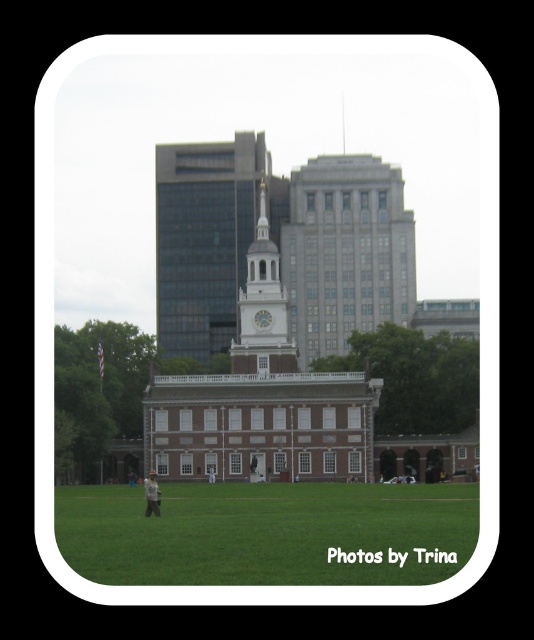
You are standing at point (256, 316) and want to walk to the front entrance of Independence Hall. Which direction should you move relative to point (213, 289)?

Since point (213, 289) is behind point (256, 316), you should move towards the direction away from point (213, 289) to reach the front entrance of Independence Hall.

You are planning to host a small picnic for 10 people in the park near the historical building. Given the green grass at lower center and the white brick tower at center, which area would be more suitable for setting up the picnic spot?

The green grass at lower center is more suitable for setting up the picnic spot because it has a smaller size compared to the white brick tower at center, making it a more appropriate area for a small gathering.